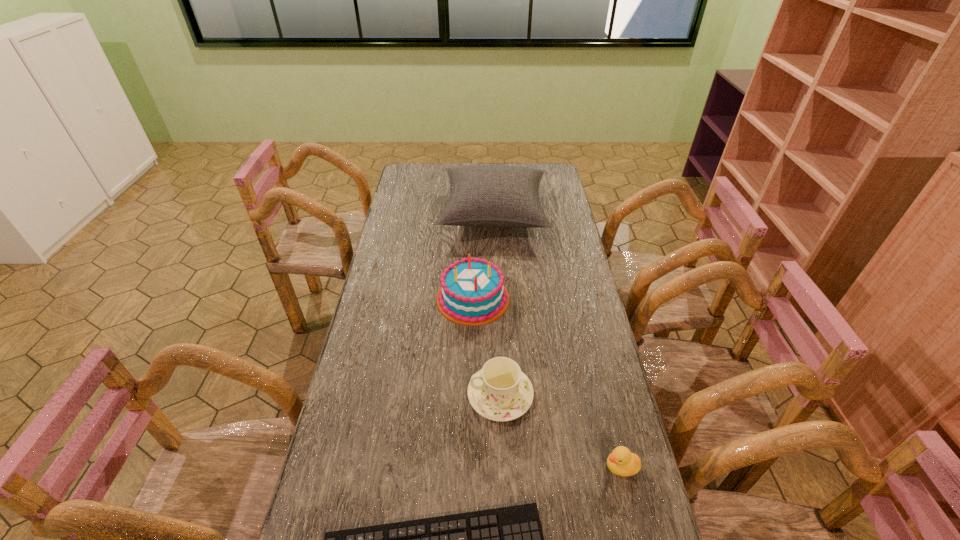
Locate an element on the screen. Image resolution: width=960 pixels, height=540 pixels. the tallest object is located at coordinates (480, 195).

This screenshot has width=960, height=540. Find the location of `cushion`. cushion is located at coordinates (480, 195).

You are a GUI agent. You are given a task and a screenshot of the screen. Output one action in this format:
    pyautogui.click(x=<x>, y=<y>)
    Task: Click on the birthday cake
    
    Given the screenshot: What is the action you would take?
    pyautogui.click(x=473, y=292)

At what (x,y) coordinates should I click in order to perform the action: click on the second farthest object. Please return your answer as a coordinate pair (x, y). Image resolution: width=960 pixels, height=540 pixels. Looking at the image, I should click on (473, 292).

Find the location of a particular element. This screenshot has width=960, height=540. the third shortest object is located at coordinates (500, 391).

Identify the location of chinaware. The width and height of the screenshot is (960, 540). (500, 391).

Find the location of a particular element. This screenshot has width=960, height=540. the second shortest object is located at coordinates (621, 461).

Image resolution: width=960 pixels, height=540 pixels. I want to click on the fourth farthest object, so click(x=621, y=461).

I want to click on free space located 0.200m on the front of the farthest object, so click(496, 281).

Locate an element on the screen. This screenshot has height=540, width=960. vacant space located on the front of the birthday cake is located at coordinates (470, 432).